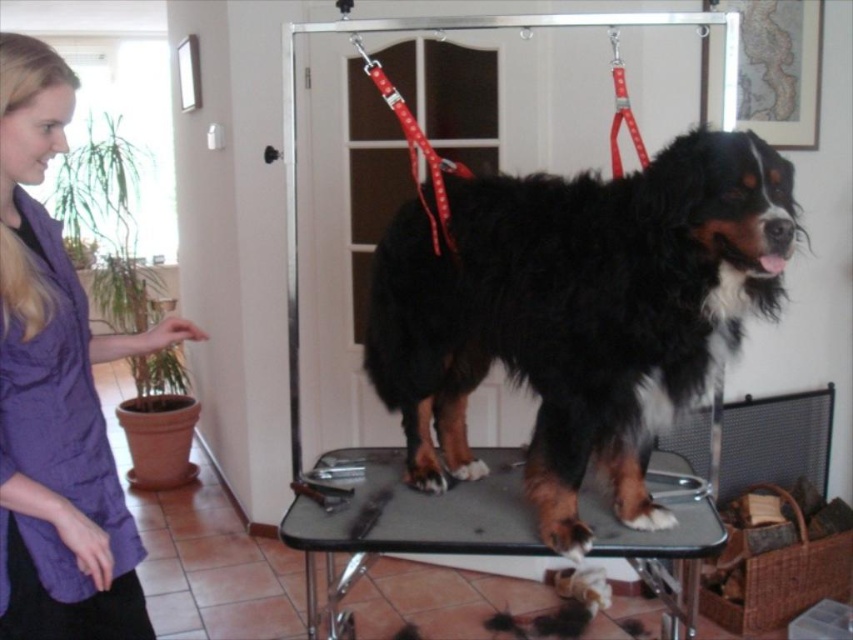
Question: Is purple fabric shirt at left wider than metallic gray grooming table at center?

Choices:
 (A) yes
 (B) no

Answer: (B)

Question: Among these points, which one is nearest to the camera?

Choices:
 (A) (368, 456)
 (B) (677, 396)
 (C) (21, 244)

Answer: (C)

Question: Considering the real-world distances, which object is closest to the purple fabric shirt at left?

Choices:
 (A) metallic gray grooming table at center
 (B) black shaggy dog at center

Answer: (A)

Question: Can you confirm if black shaggy dog at center is positioned above purple fabric shirt at left?

Choices:
 (A) no
 (B) yes

Answer: (B)

Question: Can you confirm if black shaggy dog at center is positioned above purple fabric shirt at left?

Choices:
 (A) yes
 (B) no

Answer: (A)

Question: Which point is closer to the camera taking this photo?

Choices:
 (A) (462, 236)
 (B) (68, 410)
 (C) (453, 486)

Answer: (B)